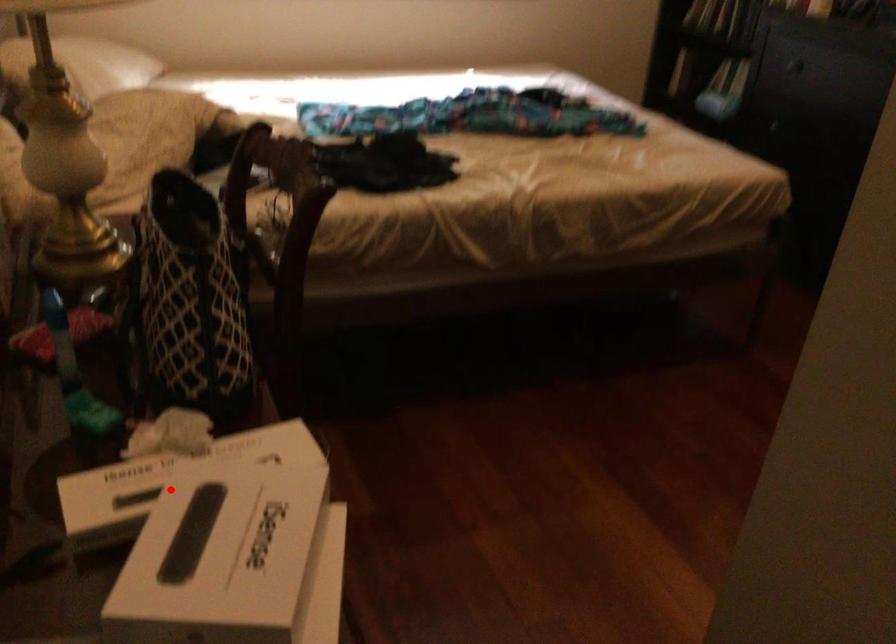
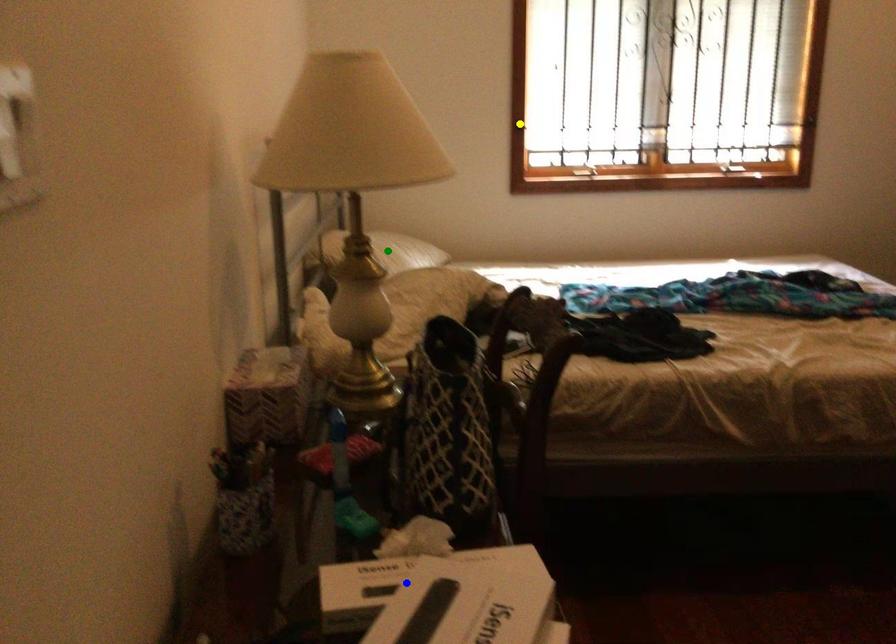
Question: I am providing you with two images of the same scene from different viewpoints. A red point is marked on the first image. You are given multiple points on the second image. Which mark in image 2 goes with the point in image 1?

Choices:
 (A) green point
 (B) blue point
 (C) yellow point

Answer: (B)